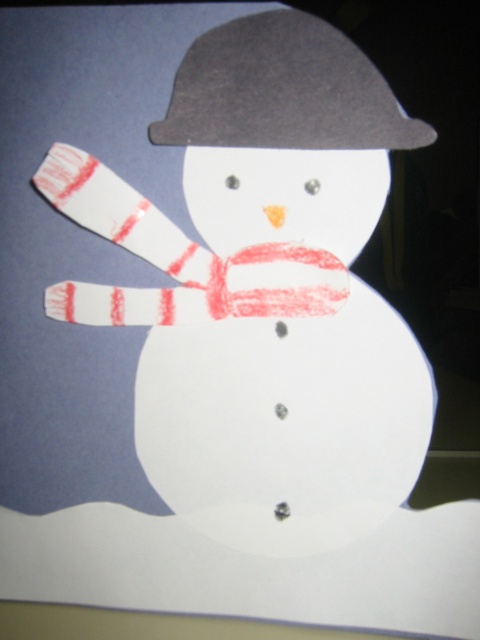
Question: Can you confirm if white paper snowman at center is wider than dark gray felt hat at upper center?

Choices:
 (A) yes
 (B) no

Answer: (A)

Question: Which object is closer to the camera taking this photo?

Choices:
 (A) dark gray felt hat at upper center
 (B) white paper snowman at center

Answer: (A)

Question: Which point is farther to the camera?

Choices:
 (A) dark gray felt hat at upper center
 (B) white paper snowman at center

Answer: (B)

Question: Can you confirm if white paper snowman at center is wider than dark gray felt hat at upper center?

Choices:
 (A) yes
 (B) no

Answer: (A)

Question: Is white paper snowman at center smaller than dark gray felt hat at upper center?

Choices:
 (A) yes
 (B) no

Answer: (B)